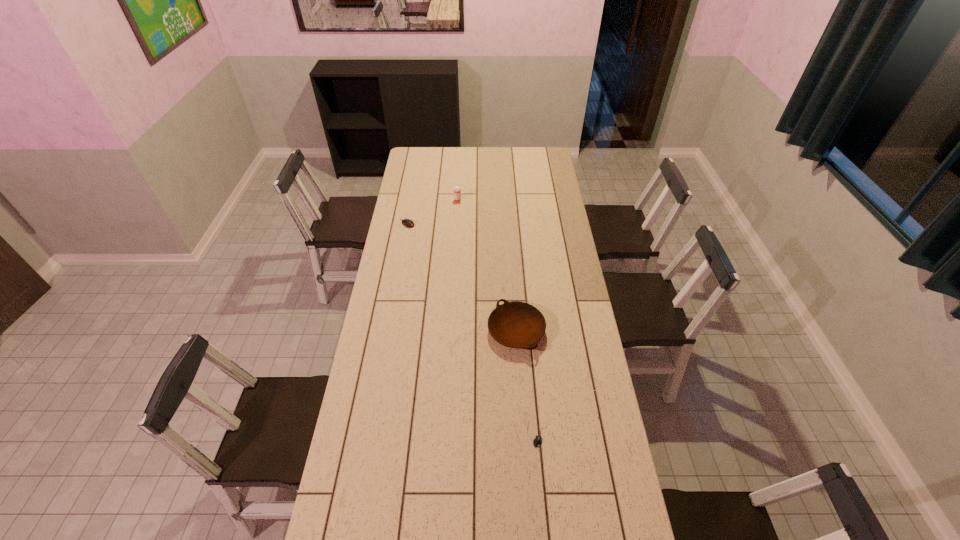
I want to click on medicine, so (x=457, y=190).

You are a GUI agent. You are given a task and a screenshot of the screen. Output one action in this format:
    pyautogui.click(x=<x>, y=<y>)
    Task: Click on the farthest object
    
    Given the screenshot: What is the action you would take?
    pyautogui.click(x=457, y=190)

This screenshot has height=540, width=960. What are the coordinates of `plate` in the screenshot? It's located at (516, 324).

The height and width of the screenshot is (540, 960). In order to click on the third farthest object in this screenshot , I will do `click(516, 324)`.

Locate an element on the screen. the left mouse is located at coordinates (408, 223).

The width and height of the screenshot is (960, 540). What are the coordinates of `the leftmost object` in the screenshot? It's located at (408, 223).

Identify the location of the shorter mouse. The height and width of the screenshot is (540, 960). (537, 441).

At what (x,y) coordinates should I click in order to perform the action: click on the right mouse. Please return your answer as a coordinate pair (x, y). Looking at the image, I should click on (537, 441).

The width and height of the screenshot is (960, 540). I want to click on free space located 0.360m on the right of the third object from right to left, so click(x=528, y=200).

Image resolution: width=960 pixels, height=540 pixels. Find the location of `free spot located on the front of the plate`. free spot located on the front of the plate is located at coordinates (520, 392).